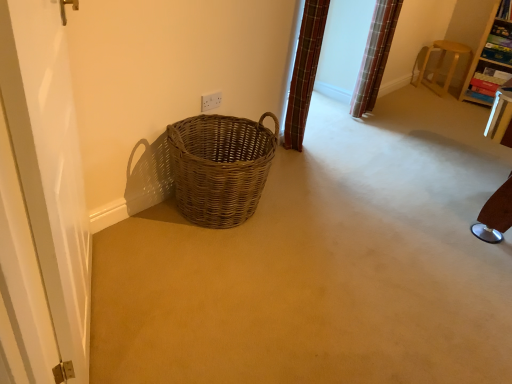
Identify the location of free space between wooden bookshelf at upper right, acting as the 1th furniture starting from the right, and plaid fabric curtain at upper right, which is the first curtain from left to right. The height and width of the screenshot is (384, 512). (399, 118).